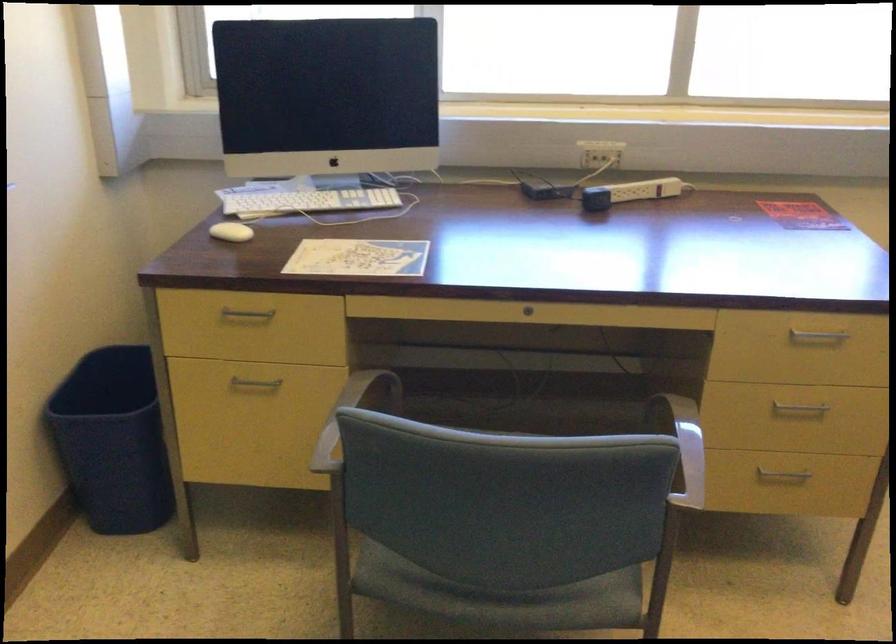
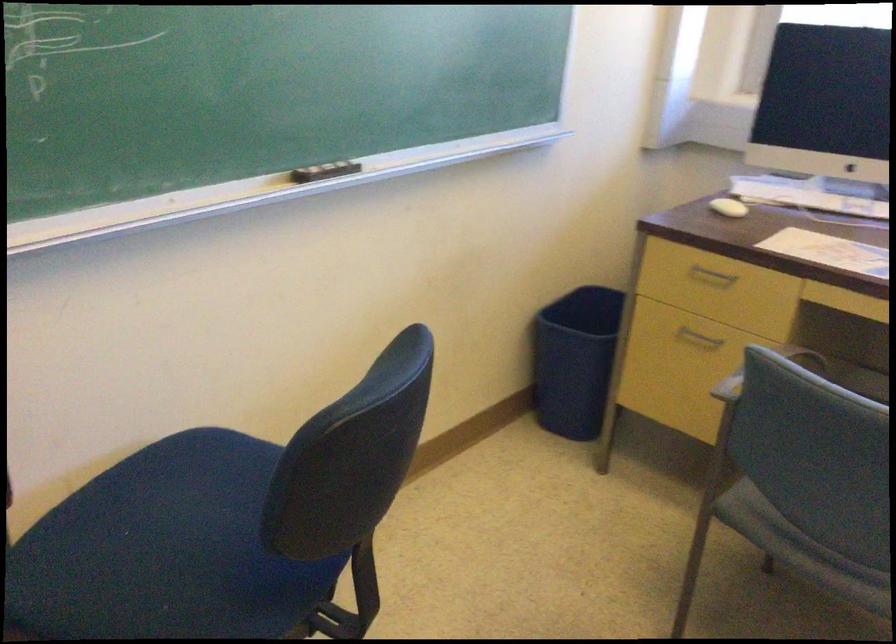
Locate, in the second image, the point that corresponds to pixel 252 391 in the first image.

(698, 337)